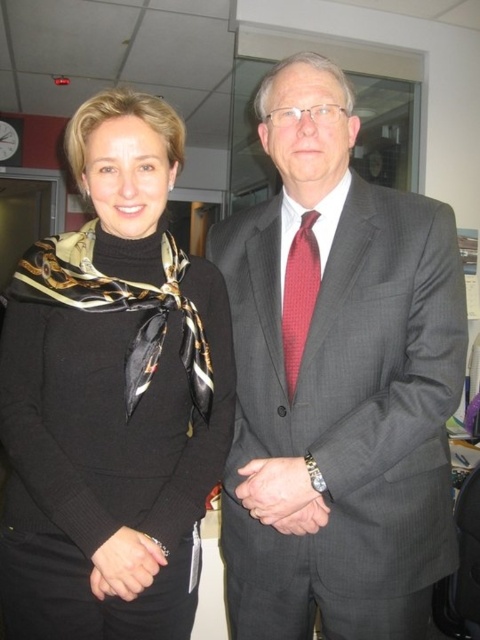
You are an office receptionist who needs to identify which accessory is lower in the image. You see the black silk scarf at left and the red textured tie at center. Which one is positioned lower?

The black silk scarf at left is positioned under the red textured tie at center, so it is lower in the image.

You are an office receptionist who needs to determine which item takes up more horizontal space when viewed from the front. Which one is wider between the matte gray suit at center and the black silk scarf at left?

The matte gray suit at center is wider than the black silk scarf at left, so the matte gray suit at center takes up more horizontal space when viewed from the front.